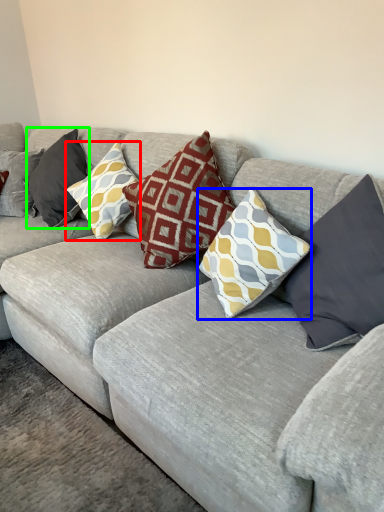
Question: Which object is the closest to the pillow (highlighted by a red box)? Choose among these: pillow (highlighted by a blue box) or pillow (highlighted by a green box).

Choices:
 (A) pillow
 (B) pillow

Answer: (B)